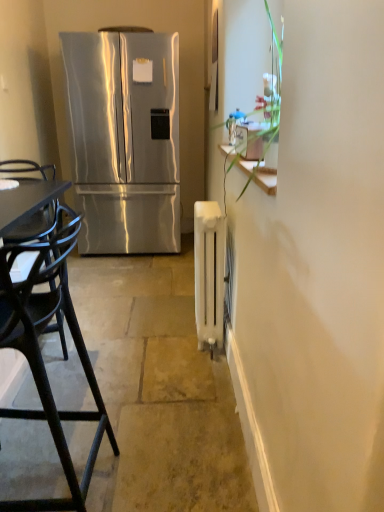
Question: Would you say stainless steel refrigerator at left is to the left or to the right of satin silver exhaust hood at upper center in the picture?

Choices:
 (A) left
 (B) right

Answer: (A)

Question: Is point (139, 151) positioned closer to the camera than point (130, 28)?

Choices:
 (A) closer
 (B) farther

Answer: (B)

Question: Which object is positioned closest to the white matte radiator at center?

Choices:
 (A) black plastic chair at left
 (B) stainless steel refrigerator at left
 (C) satin silver exhaust hood at upper center
 (D) white matte radiator at right

Answer: (D)

Question: Which of these objects is positioned closest to the white matte radiator at center?

Choices:
 (A) white matte radiator at right
 (B) satin silver exhaust hood at upper center
 (C) black plastic chair at left
 (D) stainless steel refrigerator at left

Answer: (A)